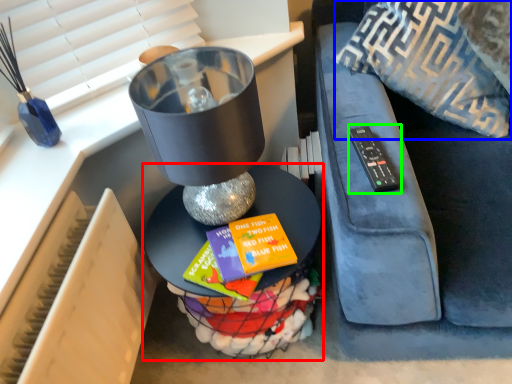
Question: Which object is positioned farthest from table (highlighted by a red box)? Select from throw pillow (highlighted by a blue box) and remote (highlighted by a green box).

Choices:
 (A) throw pillow
 (B) remote

Answer: (A)